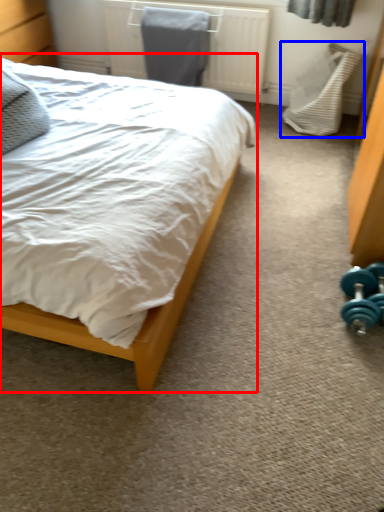
Question: Among these objects, which one is farthest to the camera, bed (highlighted by a red box) or swivel chair (highlighted by a blue box)?

Choices:
 (A) bed
 (B) swivel chair

Answer: (B)